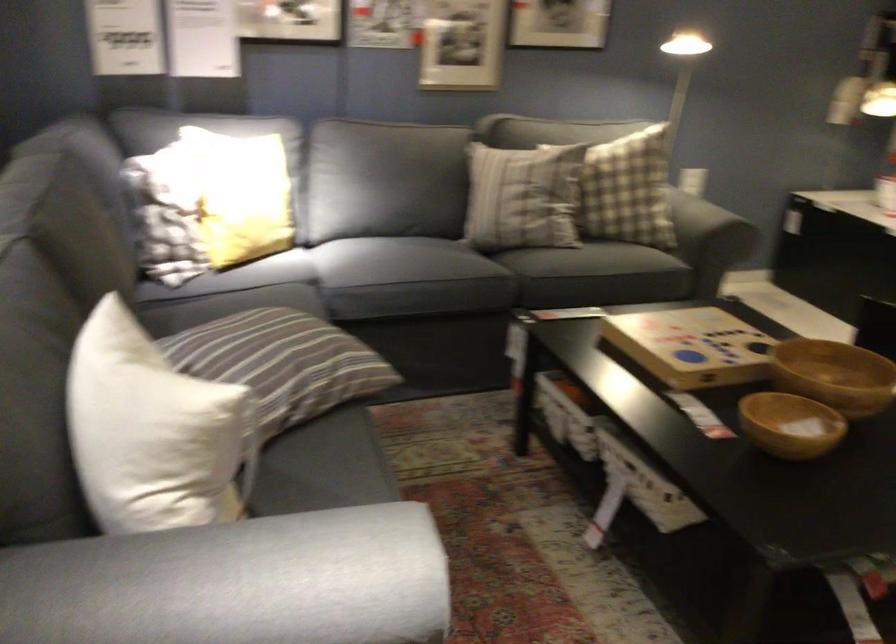
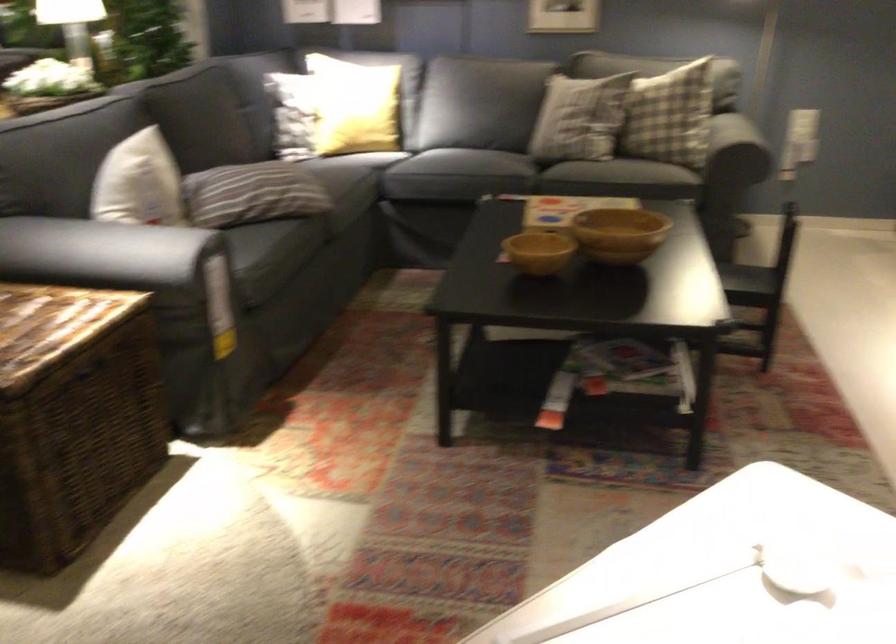
Locate, in the second image, the point that corresponds to (x=235, y=562) in the first image.

(117, 252)